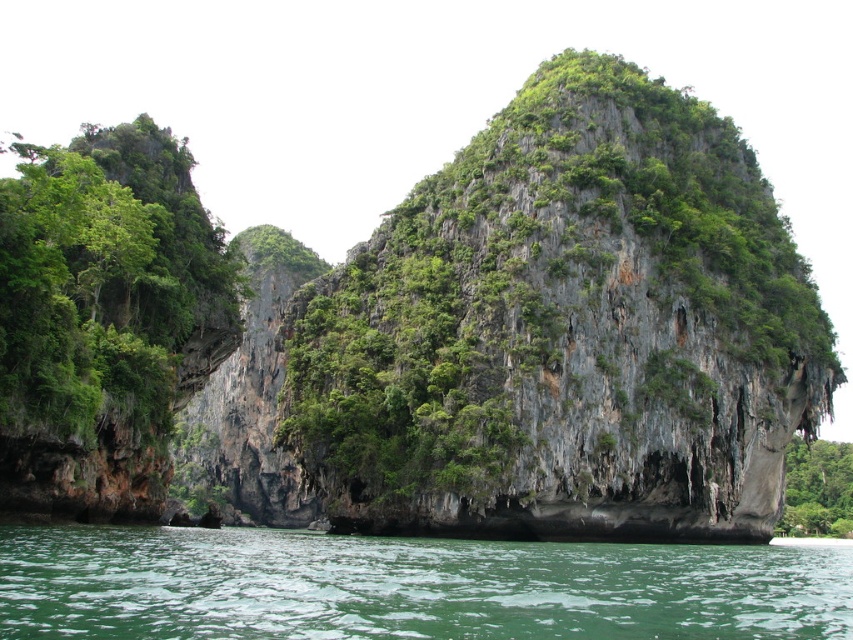
Question: Which object appears farthest from the camera in this image?

Choices:
 (A) green leafy vegetation at left
 (B) green leafy vegetation at lower right
 (C) green liquid water at lower center

Answer: (B)

Question: Which of the following is the farthest from the observer?

Choices:
 (A) (152, 353)
 (B) (390, 621)
 (C) (790, 509)

Answer: (C)

Question: From the image, what is the correct spatial relationship of green liquid water at lower center in relation to green leafy vegetation at lower right?

Choices:
 (A) below
 (B) above

Answer: (B)

Question: Which object is the closest to the green leafy vegetation at left?

Choices:
 (A) green leafy vegetation at lower right
 (B) green liquid water at lower center

Answer: (B)

Question: In this image, where is green liquid water at lower center located relative to green leafy vegetation at lower right?

Choices:
 (A) below
 (B) above

Answer: (B)

Question: Is green liquid water at lower center smaller than green leafy vegetation at lower right?

Choices:
 (A) yes
 (B) no

Answer: (A)